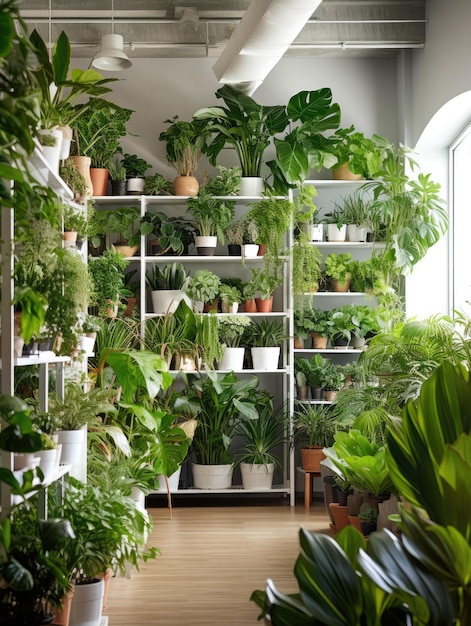
Identify the location of white plant pot. This screenshot has height=626, width=471. (261, 479).